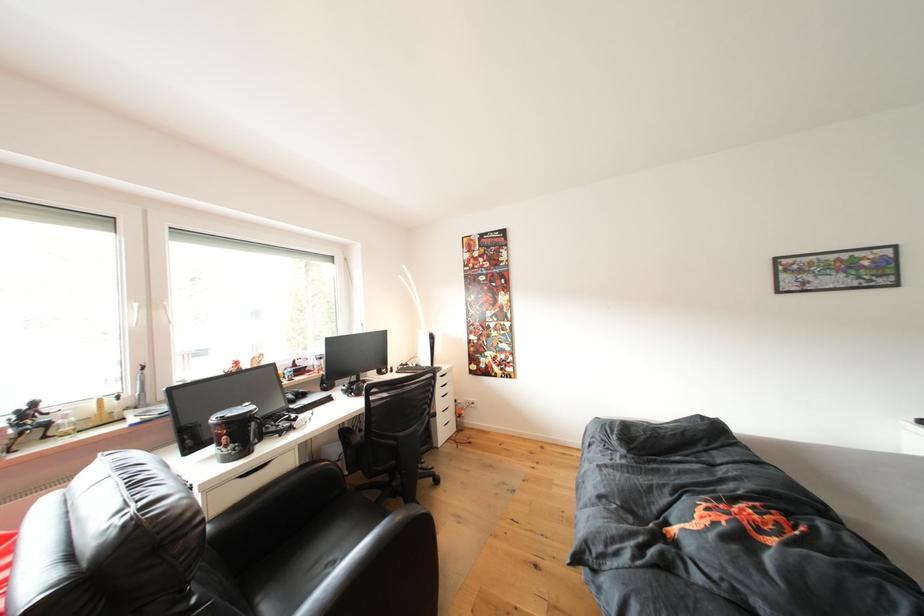
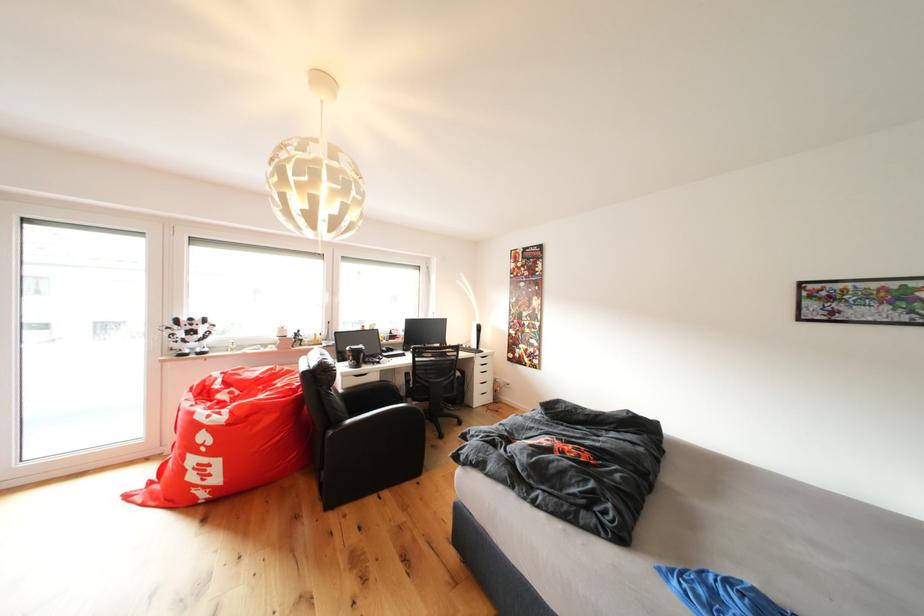
In the second image, find the point that corresponds to point 444,370 in the first image.

(490, 354)